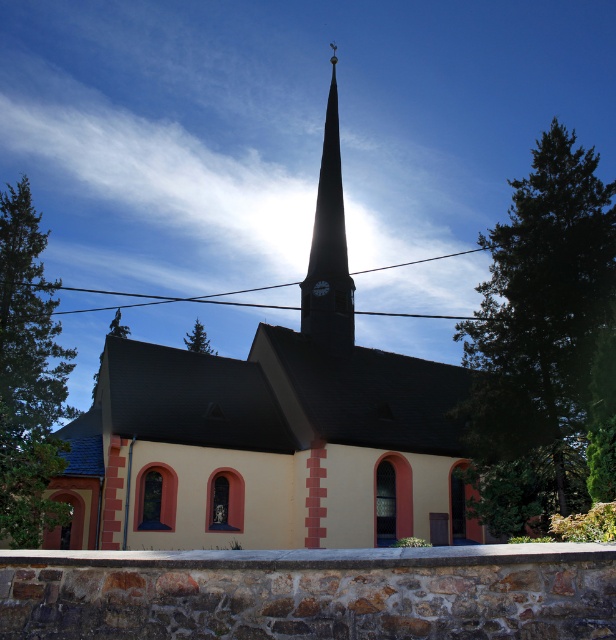
Who is higher up, yellow matte church at center or smooth gray spire at center?

smooth gray spire at center is higher up.

Consider the image. Is yellow matte church at center above smooth gray spire at center?

No, yellow matte church at center is not above smooth gray spire at center.

Between point (237, 387) and point (347, 337), which one is positioned in front?

Point (237, 387)

The width and height of the screenshot is (616, 640). I want to click on yellow matte church at center, so click(272, 429).

Is point (102, 380) farther from viewer compared to point (325, 284)?

No, it is not.

Is point (115, 531) more distant than point (315, 289)?

No, (115, 531) is in front of (315, 289).

You are a GUI agent. You are given a task and a screenshot of the screen. Output one action in this format:
    pyautogui.click(x=<x>, y=<y>)
    Task: Click on the yellow matte church at center
    The image size is (616, 640).
    Given the screenshot: What is the action you would take?
    pyautogui.click(x=272, y=429)

Which is above, smooth gray spire at center or black glass clock at upper center?

→ smooth gray spire at center is higher up.

Is smooth gray spire at center smaller than black glass clock at upper center?

Actually, smooth gray spire at center might be larger than black glass clock at upper center.

Between point (309, 326) and point (320, 282), which one is positioned in front?

Point (309, 326) is in front.

Locate an element on the screen. The height and width of the screenshot is (640, 616). smooth gray spire at center is located at coordinates click(x=328, y=248).